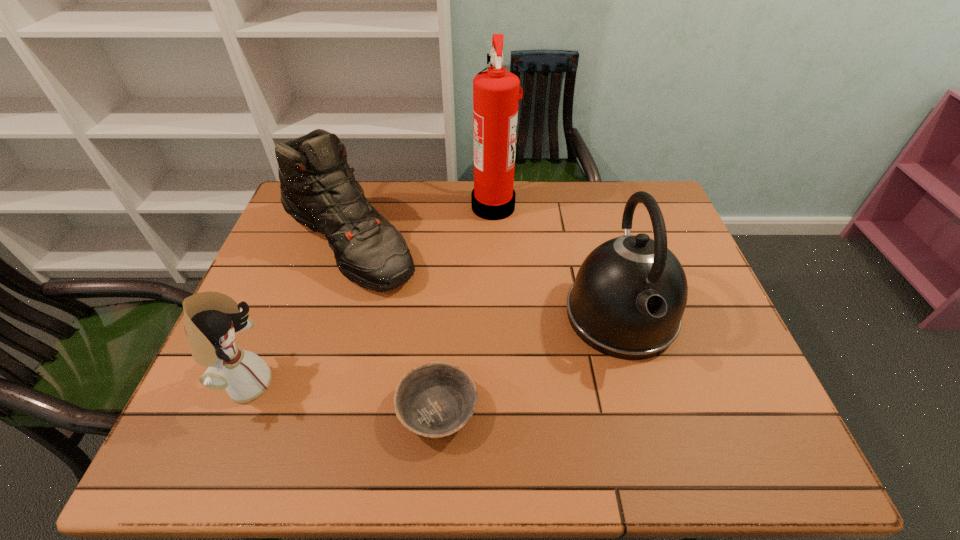
At what (x,y) coordinates should I click in order to perform the action: click on vacant space located at the front face of the fourth tallest object. Please return your answer as a coordinate pair (x, y). The image size is (960, 540). Looking at the image, I should click on (432, 384).

The image size is (960, 540). I want to click on vacant region located on the back of the shortest object, so (443, 343).

This screenshot has width=960, height=540. Identify the location of fire extinguisher that is at the far edge. (496, 96).

The image size is (960, 540). Find the location of `ski boot at the far edge`. ski boot at the far edge is located at coordinates (318, 189).

The height and width of the screenshot is (540, 960). I want to click on object present at the near edge, so click(434, 400).

I want to click on ski boot at the left edge, so click(318, 189).

The width and height of the screenshot is (960, 540). Identify the location of doll positioned at the left edge. (211, 319).

You are a GUI agent. You are given a task and a screenshot of the screen. Output one action in this format:
    pyautogui.click(x=<x>, y=<y>)
    Task: Click on the object that is at the right edge
    The width and height of the screenshot is (960, 540).
    Given the screenshot: What is the action you would take?
    click(630, 293)

Locate an element on the screen. The height and width of the screenshot is (540, 960). object present at the far left corner is located at coordinates pyautogui.click(x=318, y=189).

Locate an element on the screen. vacant space at the far edge of the desktop is located at coordinates (460, 202).